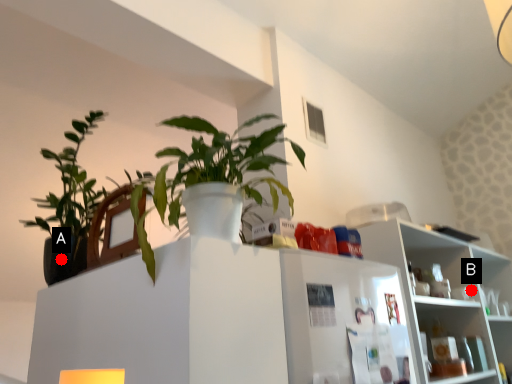
Question: Two points are circled on the image, labeled by A and B beside each circle. Which point is closer to the camera?

Choices:
 (A) A is closer
 (B) B is closer

Answer: (A)